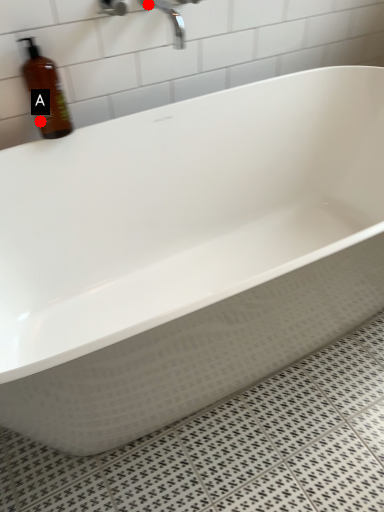
Question: Two points are circled on the image, labeled by A and B beside each circle. Which of the following is the farthest from the observer?

Choices:
 (A) A is further
 (B) B is further

Answer: (A)